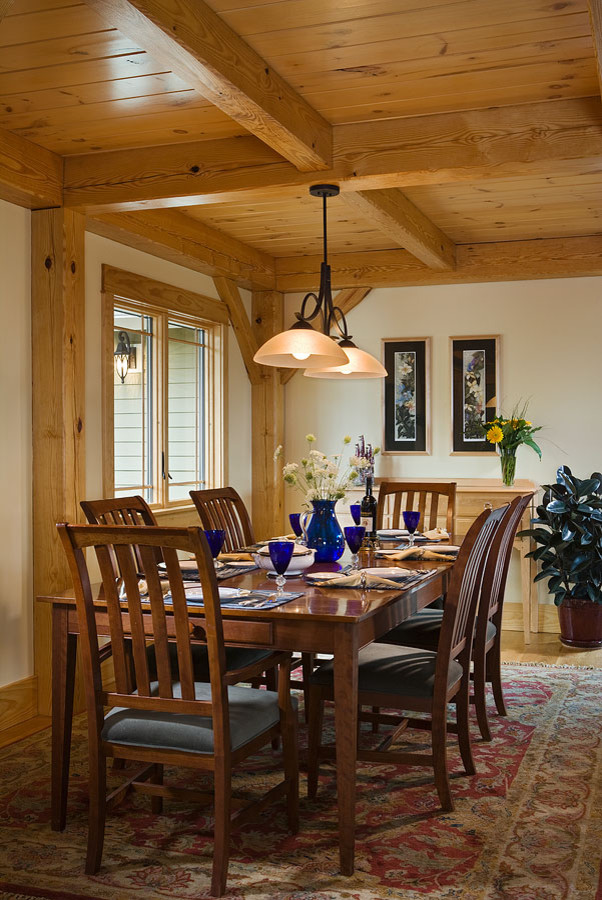
Where is `table`? The width and height of the screenshot is (602, 900). table is located at coordinates (323, 592), (479, 482).